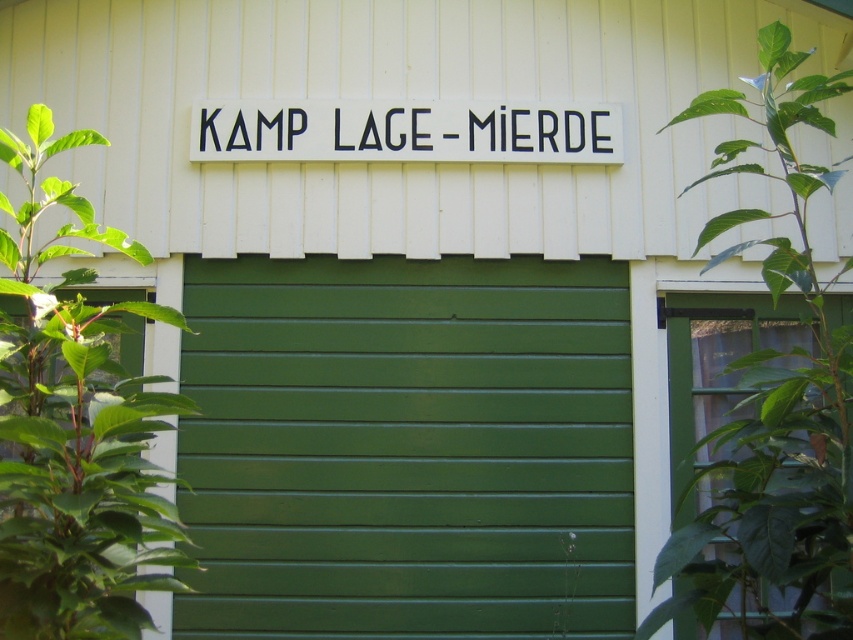
Measure the distance between point (509,608) and camera.

Point (509,608) is 17.45 feet from camera.

Does green painted metal/glass garage door at center have a smaller size compared to green leafy plant at left?

Indeed, green painted metal/glass garage door at center has a smaller size compared to green leafy plant at left.

I want to click on green painted metal/glass garage door at center, so click(407, 448).

Does green leafy plant at left come behind black plastic sign at upper center?

No.

Is green leafy plant at left in front of black plastic sign at upper center?

Yes, green leafy plant at left is closer to the viewer.

The image size is (853, 640). In order to click on green leafy plant at left in this screenshot , I will do `click(74, 428)`.

Does green painted metal/glass garage door at center come in front of black plastic sign at upper center?

That is True.

Describe the element at coordinates (407, 448) in the screenshot. I see `green painted metal/glass garage door at center` at that location.

At what (x,y) coordinates should I click in order to perform the action: click on green painted metal/glass garage door at center. Please return your answer as a coordinate pair (x, y). This screenshot has width=853, height=640. Looking at the image, I should click on (407, 448).